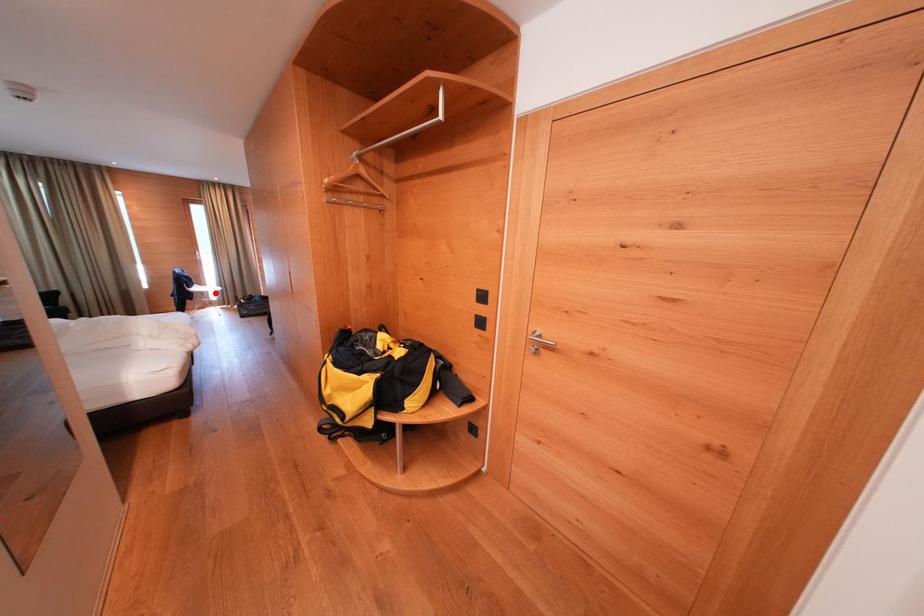
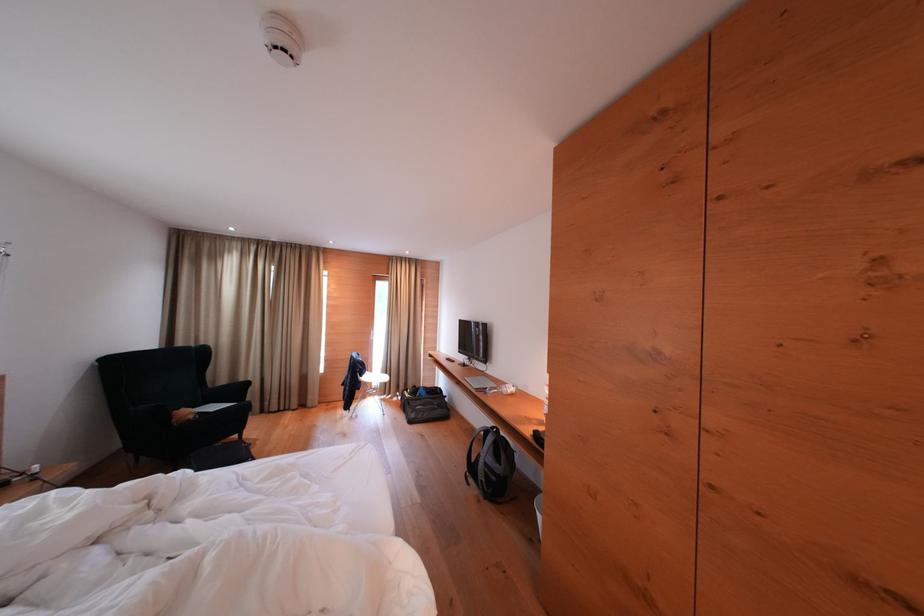
The point at the highlighted location is marked in the first image. Where is the corresponding point in the second image?

(383, 379)